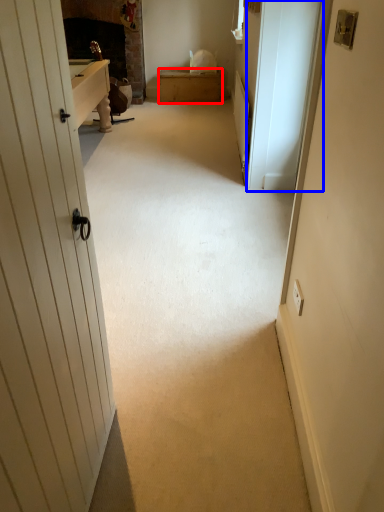
Question: Among these objects, which one is nearest to the camera, furniture (highlighted by a red box) or screen door (highlighted by a blue box)?

Choices:
 (A) furniture
 (B) screen door

Answer: (B)